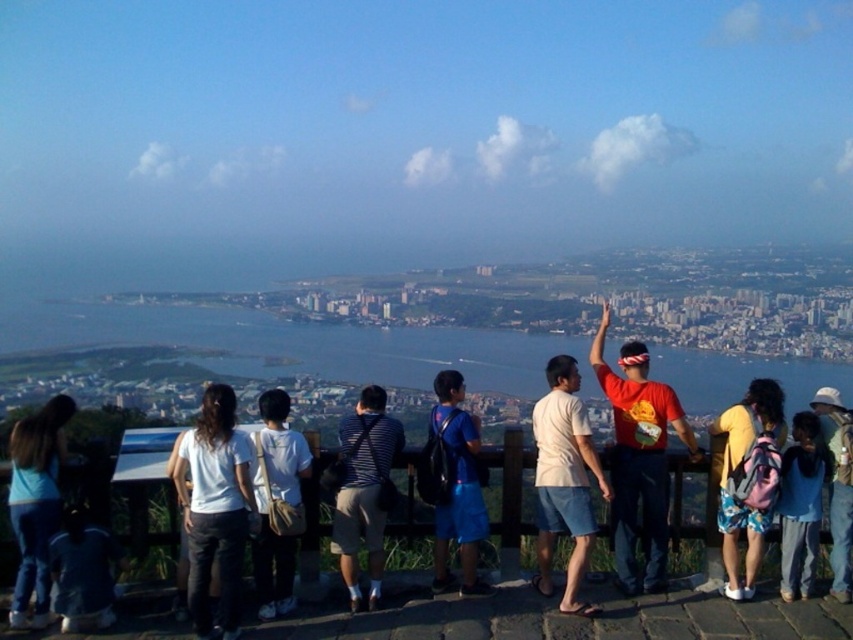
Which is above, blue water at center or blue denim jeans at lower right?

blue water at center is above.

Where is `blue water at center`? The height and width of the screenshot is (640, 853). blue water at center is located at coordinates (291, 346).

Find the location of a particular element. blue water at center is located at coordinates (291, 346).

Looking at this image, between blue water at center and blue fabric backpack at center, which one has more height?

blue fabric backpack at center is taller.

Based on the photo, can you confirm if blue water at center is smaller than blue fabric backpack at center?

Actually, blue water at center might be larger than blue fabric backpack at center.

Does point (50, 342) lie in front of point (459, 499)?

That is False.

Locate an element on the screen. This screenshot has width=853, height=640. blue water at center is located at coordinates (291, 346).

Between blue fabric backpack at center and pink backpack at center, which one has more height?

blue fabric backpack at center is taller.

How much distance is there between blue fabric backpack at center and pink backpack at center?

blue fabric backpack at center and pink backpack at center are 660.09 feet apart.

Describe the element at coordinates (457, 486) in the screenshot. I see `blue fabric backpack at center` at that location.

At what (x,y) coordinates should I click in order to perform the action: click on blue fabric backpack at center. Please return your answer as a coordinate pair (x, y). This screenshot has height=640, width=853. Looking at the image, I should click on (457, 486).